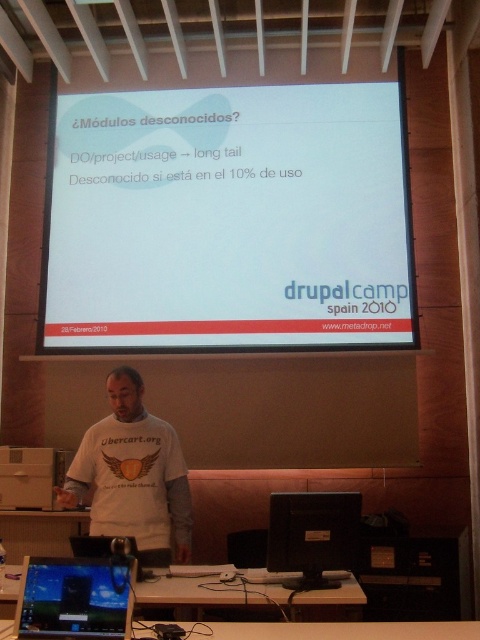
Does point (290, 296) come behind point (105, 596)?

Yes.

The height and width of the screenshot is (640, 480). What are the coordinates of `white matte projection screen at upper center` in the screenshot? It's located at (228, 220).

Who is more forward, (201, 132) or (123, 593)?

Positioned in front is point (123, 593).

In order to click on white matte projection screen at upper center in this screenshot , I will do `click(228, 220)`.

Which is in front, point (96, 422) or point (37, 577)?

Positioned in front is point (37, 577).

Locate an element on the screen. white cotton shirt at center is located at coordinates (132, 474).

Which is more to the left, black glossy laptop at lower left or black plastic monitor at center?

black glossy laptop at lower left is more to the left.

Can you confirm if black glossy laptop at lower left is positioned below black plastic monitor at center?

Incorrect, black glossy laptop at lower left is not positioned below black plastic monitor at center.

Between point (127, 589) and point (352, 554), which one is positioned behind?

The point (352, 554) is more distant.

Image resolution: width=480 pixels, height=640 pixels. I want to click on black glossy laptop at lower left, so click(74, 598).